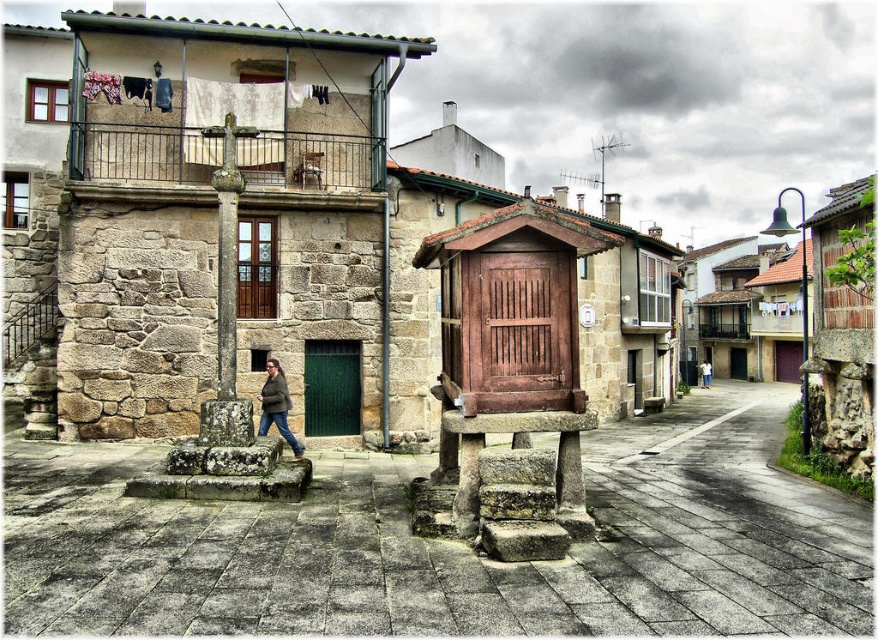
Looking at this image, who is lower down, stone alley at center or denim pants at center?

denim pants at center

Is stone alley at center smaller than denim pants at center?

Incorrect, stone alley at center is not smaller in size than denim pants at center.

At what (x,y) coordinates should I click in order to perform the action: click on stone alley at center. Please return your answer as a coordinate pair (x, y). Looking at the image, I should click on (447, 545).

Is brown leather jacket at center positioned before denim pants at center?

Yes, it is in front of denim pants at center.

Can you confirm if brown leather jacket at center is bigger than denim pants at center?

Incorrect, brown leather jacket at center is not larger than denim pants at center.

Which is behind, point (297, 452) or point (710, 365)?

Point (710, 365)

At what (x,y) coordinates should I click in order to perform the action: click on brown leather jacket at center. Please return your answer as a coordinate pair (x, y). The width and height of the screenshot is (878, 640). Looking at the image, I should click on (276, 404).

Who is lower down, stone alley at center or brown leather jacket at center?

Positioned lower is stone alley at center.

Is stone alley at center thinner than brown leather jacket at center?

Incorrect, stone alley at center's width is not less than brown leather jacket at center's.

Locate an element on the screen. Image resolution: width=878 pixels, height=640 pixels. stone alley at center is located at coordinates (447, 545).

Identify the location of stone alley at center. The width and height of the screenshot is (878, 640). (447, 545).